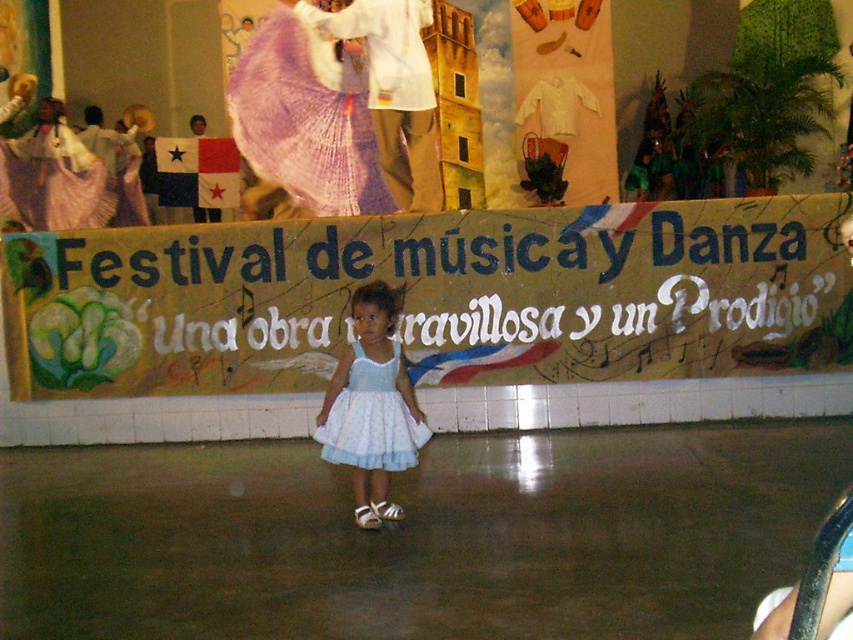
You are a photographer at the Festival de M?sic y Danza. You need to capture a photo that includes both the yellow paper banner at center and the white lace dress at center. Which object should you focus on first to ensure both are in frame?

The yellow paper banner at center has a smaller size compared to the white lace dress at center. To ensure both are in frame, focus on the larger object first, which is the white lace dress at center, then adjust the camera to include the smaller yellow paper banner at center.

You are a photographer standing at the edge of the festival stage. You want to take a photo of the yellow paper banner at center and the white lace dress at center. If your camera can focus on objects within 10 feet, will both subjects be in focus?

The distance between the yellow paper banner at center and the white lace dress at center is 9.72 feet, which is within the camera focus range of 10 feet. Therefore, both subjects will be in focus.

Where is the yellow paper banner at center located in the image?

The yellow paper banner at center is located at point (x=433, y=298).